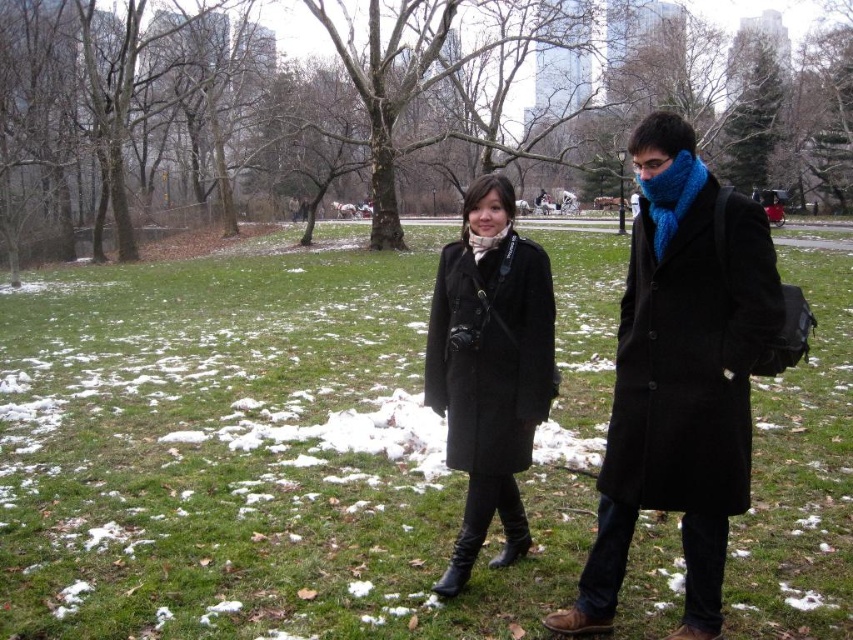
You are a photographer trying to capture both the blue knitted scarf at right and the blue knitted scarf at center in a single shot. Which scarf should you focus on first to ensure both are in frame?

The blue knitted scarf at right is positioned on the right side of the blue knitted scarf at center. To capture both in a single shot, focus on the blue knitted scarf at center first, then adjust the frame to include the one on the right.

You are a photographer trying to capture both the blue knitted scarf at right and the blue knitted scarf at center in a single shot. Which scarf should you focus on to ensure both are in the frame without zooming in?

You should focus on the blue knitted scarf at center because it is smaller in size, allowing both the larger blue knitted scarf at right and the smaller one at center to fit within the camera frame without zooming in.

You are a photographer trying to capture both the black wool coat at center and the blue knitted scarf at center in a single frame. Given that your camera has a fixed focal length, which object should you focus on to ensure both are in the frame without zooming in or out?

Since the black wool coat at center is wider than the blue knitted scarf at center, you should focus on the black wool coat at center to ensure both objects fit within the frame.